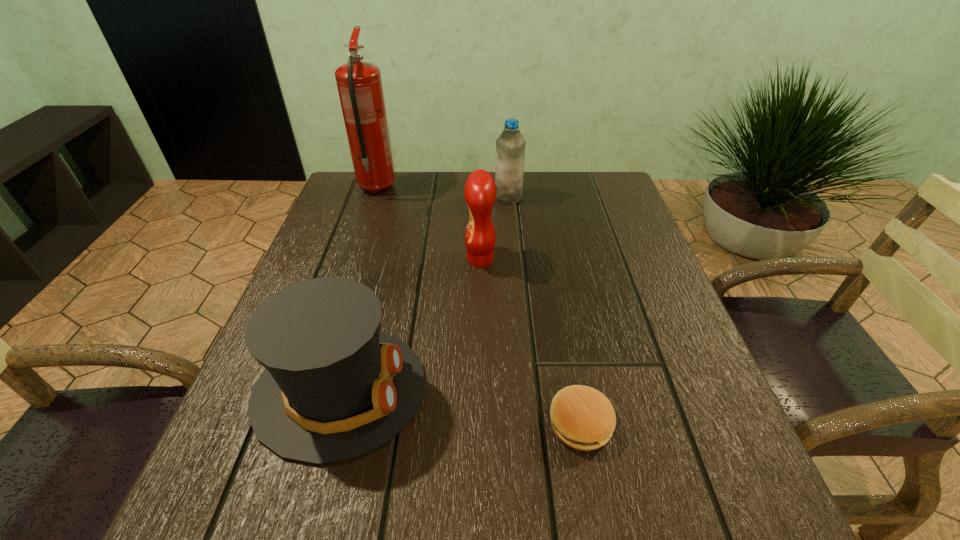
The image size is (960, 540). In order to click on empty location between the shortest object and the water bottle in this screenshot , I will do `click(544, 310)`.

You are a GUI agent. You are given a task and a screenshot of the screen. Output one action in this format:
    pyautogui.click(x=<x>, y=<y>)
    Task: Click on the free space between the water bottle and the shortest object
    Image resolution: width=960 pixels, height=540 pixels.
    Given the screenshot: What is the action you would take?
    pyautogui.click(x=544, y=310)

Where is `free area in between the patty and the water bottle`? Image resolution: width=960 pixels, height=540 pixels. free area in between the patty and the water bottle is located at coordinates (544, 310).

Identify which object is the third nearest to the condiment. Please provide its 2D coordinates. Your answer should be formatted as a tuple, i.e. [(x, y)], where the tuple contains the x and y coordinates of a point satisfying the conditions above.

[(359, 83)]

Locate which object is the third closest to the third object from left to right. Please provide its 2D coordinates. Your answer should be formatted as a tuple, i.e. [(x, y)], where the tuple contains the x and y coordinates of a point satisfying the conditions above.

[(359, 83)]

You are a GUI agent. You are given a task and a screenshot of the screen. Output one action in this format:
    pyautogui.click(x=<x>, y=<y>)
    Task: Click on the vacant area in the image that satisfies the following two spatial constraints: 1. on the front side of the water bottle; 2. with goggles on the front of the fourth tallest object
    The width and height of the screenshot is (960, 540).
    Given the screenshot: What is the action you would take?
    pyautogui.click(x=525, y=390)

At what (x,y) coordinates should I click in order to perform the action: click on free spot that satisfies the following two spatial constraints: 1. on the front side of the water bottle; 2. on the label side of the third object from left to right. Please return your answer as a coordinate pair (x, y). This screenshot has width=960, height=540. Looking at the image, I should click on (514, 259).

Locate an element on the screen. free location that satisfies the following two spatial constraints: 1. on the front side of the shortest object; 2. on the left side of the water bottle is located at coordinates (528, 423).